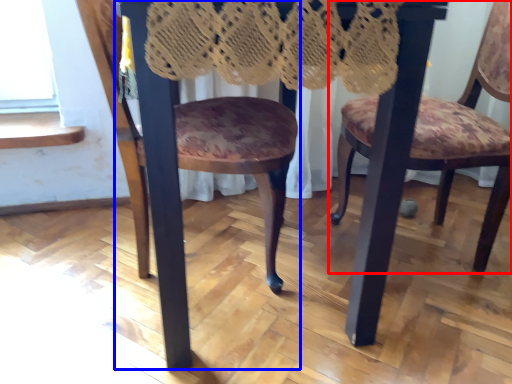
Question: Which point is closer to the camera, chair (highlighted by a red box) or chair (highlighted by a blue box)?

Choices:
 (A) chair
 (B) chair

Answer: (B)